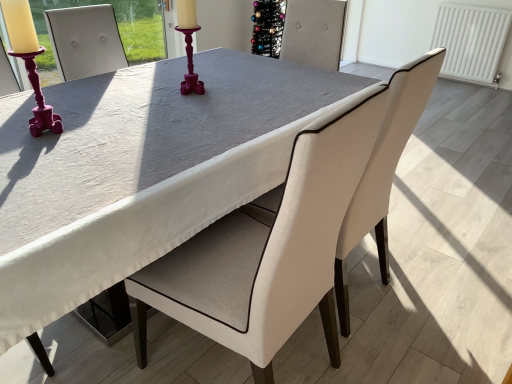
The image size is (512, 384). In order to click on white fabric chair at center, positioned as the first chair in left-to-right order in this screenshot , I will do `click(268, 249)`.

The width and height of the screenshot is (512, 384). What do you see at coordinates (268, 249) in the screenshot?
I see `white fabric chair at center, positioned as the first chair in left-to-right order` at bounding box center [268, 249].

Find the location of a particular element. This screenshot has height=384, width=512. white fabric chair at center, the 2th chair positioned from the left is located at coordinates (383, 171).

The image size is (512, 384). Identify the location of matte pink candlestick at left. (39, 98).

Is the surface of white fabric chair at center, which is the 2th chair from right to left, in direct contact with white fabric chair at center, the 2th chair positioned from the left?

No, white fabric chair at center, which is the 2th chair from right to left, is not in contact with white fabric chair at center, the 2th chair positioned from the left.

Can you tell me how much white fabric chair at center, positioned as the first chair in left-to-right order, and white fabric chair at center, the first chair viewed from the right, differ in facing direction?

They differ by 0.205 degrees in their facing directions.

Between white fabric chair at center, which is the 2th chair from right to left, and white fabric chair at center, the first chair viewed from the right, which one has more height?

Standing taller between the two is white fabric chair at center, which is the 2th chair from right to left.

From a real-world perspective, does white fabric chair at center, positioned as the first chair in left-to-right order, sit lower than white fabric chair at center, the first chair viewed from the right?

No, from a real-world perspective, white fabric chair at center, positioned as the first chair in left-to-right order, is not under white fabric chair at center, the first chair viewed from the right.

Considering the relative sizes of white fabric chair at center, positioned as the first chair in left-to-right order, and matte pink candlestick at left in the image provided, is white fabric chair at center, positioned as the first chair in left-to-right order, thinner than matte pink candlestick at left?

Incorrect, the width of white fabric chair at center, positioned as the first chair in left-to-right order, is not less than that of matte pink candlestick at left.

Between white fabric chair at center, positioned as the first chair in left-to-right order, and matte pink candlestick at left, which one appears on the left side from the viewer's perspective?

Positioned to the left is matte pink candlestick at left.

Is white fabric chair at center, which is the 2th chair from right to left, completely or partially outside of matte pink candlestick at left?

Yes, white fabric chair at center, which is the 2th chair from right to left, is located beyond the bounds of matte pink candlestick at left.

Considering the relative positions of white fabric chair at center, the 2th chair positioned from the left, and matte pink candlestick at left in the image provided, is white fabric chair at center, the 2th chair positioned from the left, behind matte pink candlestick at left?

No.

Based on the photo, is white fabric chair at center, the first chair viewed from the right, not within matte pink candlestick at left?

Indeed, white fabric chair at center, the first chair viewed from the right, is completely outside matte pink candlestick at left.

Based on the photo, from the image's perspective, is white fabric chair at center, the first chair viewed from the right, positioned above or below matte pink candlestick at left?

From the image's perspective, white fabric chair at center, the first chair viewed from the right, appears below matte pink candlestick at left.

Find the location of a particular element. the 2nd chair positioned below the matte pink candlestick at left (from a real-world perspective) is located at coordinates (383, 171).

Considering the sizes of matte pink candlestick at left and white fabric chair at center, the first chair viewed from the right, in the image, is matte pink candlestick at left wider or thinner than white fabric chair at center, the first chair viewed from the right,?

Considering their sizes, matte pink candlestick at left looks slimmer than white fabric chair at center, the first chair viewed from the right.

At what (x,y) coordinates should I click in order to perform the action: click on candle holder that appears above the white fabric chair at center, the 2th chair positioned from the left (from the image's perspective). Please return your answer as a coordinate pair (x, y). The height and width of the screenshot is (384, 512). Looking at the image, I should click on (39, 98).

Between matte pink candlestick at left and white fabric chair at center, the first chair viewed from the right, which one is positioned behind?

matte pink candlestick at left is behind.

This screenshot has height=384, width=512. I want to click on chair above the white fabric chair at center, the first chair viewed from the right (from a real-world perspective), so click(x=268, y=249).

Is white fabric chair at center, the 2th chair positioned from the left, situated inside white fabric chair at center, positioned as the first chair in left-to-right order, or outside?

white fabric chair at center, the 2th chair positioned from the left, lies outside white fabric chair at center, positioned as the first chair in left-to-right order.

Is white fabric chair at center, the first chair viewed from the right, bigger than white fabric chair at center, positioned as the first chair in left-to-right order?

Yes.

Image resolution: width=512 pixels, height=384 pixels. I want to click on candle holder lying above the white fabric chair at center, which is the 2th chair from right to left (from the image's perspective), so pos(39,98).

Is matte pink candlestick at left in front of or behind white fabric chair at center, which is the 2th chair from right to left, in the image?

In the image, matte pink candlestick at left appears behind white fabric chair at center, which is the 2th chair from right to left.

Is matte pink candlestick at left completely or partially outside of white fabric chair at center, positioned as the first chair in left-to-right order?

Indeed, matte pink candlestick at left is completely outside white fabric chair at center, positioned as the first chair in left-to-right order.

Who is shorter, matte pink candlestick at left or white fabric chair at center, which is the 2th chair from right to left?

With less height is matte pink candlestick at left.

This screenshot has height=384, width=512. I want to click on chair below the white fabric chair at center, the 2th chair positioned from the left (from the image's perspective), so click(x=268, y=249).

You are a GUI agent. You are given a task and a screenshot of the screen. Output one action in this format:
    pyautogui.click(x=<x>, y=<y>)
    Task: Click on the candle holder behind the white fabric chair at center, positioned as the first chair in left-to-right order
    This screenshot has height=384, width=512.
    Given the screenshot: What is the action you would take?
    pyautogui.click(x=39, y=98)

From the picture: From the image, which object appears to be nearer to matte pink candlestick at left, white fabric chair at center, the 2th chair positioned from the left, or white fabric chair at center, which is the 2th chair from right to left?

white fabric chair at center, which is the 2th chair from right to left, is closer to matte pink candlestick at left.

Looking at the image, which one is located further to white fabric chair at center, which is the 2th chair from right to left, white fabric chair at center, the 2th chair positioned from the left, or matte pink candlestick at left?

matte pink candlestick at left.

Considering their positions, is white fabric chair at center, positioned as the first chair in left-to-right order, positioned closer to matte pink candlestick at left than white fabric chair at center, the first chair viewed from the right?

white fabric chair at center, positioned as the first chair in left-to-right order, lies closer to matte pink candlestick at left than the other object.

From the image, which object appears to be farther from white fabric chair at center, which is the 2th chair from right to left, matte pink candlestick at left or white fabric chair at center, the first chair viewed from the right?

matte pink candlestick at left is positioned further to the anchor white fabric chair at center, which is the 2th chair from right to left.

When comparing their distances from white fabric chair at center, the 2th chair positioned from the left, does matte pink candlestick at left or white fabric chair at center, positioned as the first chair in left-to-right order, seem closer?

white fabric chair at center, positioned as the first chair in left-to-right order.

When comparing their distances from white fabric chair at center, the first chair viewed from the right, does white fabric chair at center, positioned as the first chair in left-to-right order, or matte pink candlestick at left seem closer?

Among the two, white fabric chair at center, positioned as the first chair in left-to-right order, is located nearer to white fabric chair at center, the first chair viewed from the right.

Image resolution: width=512 pixels, height=384 pixels. What are the coordinates of `chair between matte pink candlestick at left and white fabric chair at center, the 2th chair positioned from the left` in the screenshot? It's located at (268, 249).